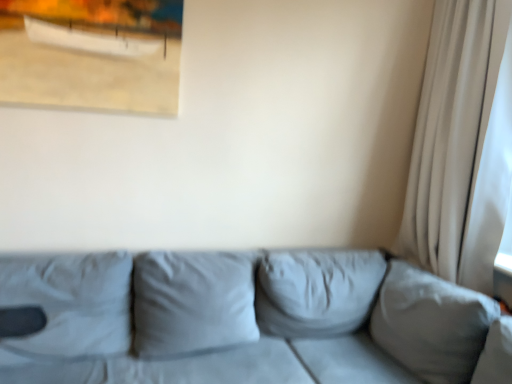
Measure the distance between suede gray couch at center and camera.

The distance of suede gray couch at center from camera is 5.02 feet.

What do you see at coordinates (244, 320) in the screenshot? I see `suede gray couch at center` at bounding box center [244, 320].

At what (x,y) coordinates should I click in order to perform the action: click on matte wooden picture frame at upper left. Please return your answer as a coordinate pair (x, y). The image size is (512, 384). Looking at the image, I should click on (91, 54).

The height and width of the screenshot is (384, 512). What do you see at coordinates (91, 54) in the screenshot?
I see `matte wooden picture frame at upper left` at bounding box center [91, 54].

What is the approximate width of white sheer curtain at right?

white sheer curtain at right is 38.11 centimeters wide.

The image size is (512, 384). Identify the location of suede gray couch at center. (244, 320).

From the image's perspective, does white sheer curtain at right appear lower than suede gray couch at center?

No, from the image's perspective, white sheer curtain at right is not below suede gray couch at center.

Can you confirm if white sheer curtain at right is shorter than suede gray couch at center?

No.

Based on the photo, how many degrees apart are the facing directions of white sheer curtain at right and suede gray couch at center?

93.3 degrees separate the facing orientations of white sheer curtain at right and suede gray couch at center.

Considering the positions of points (475, 183) and (173, 306), is point (475, 183) farther from camera compared to point (173, 306)?

That is True.

Is suede gray couch at center at the left side of white sheer curtain at right?

Yes.

Who is taller, suede gray couch at center or white sheer curtain at right?

With more height is white sheer curtain at right.

Considering the points (417, 308) and (452, 236), which point is in front, point (417, 308) or point (452, 236)?

The point (417, 308) is more forward.

Is matte wooden picture frame at upper left further to camera compared to white sheer curtain at right?

Yes, the depth of matte wooden picture frame at upper left is greater than that of white sheer curtain at right.

Between matte wooden picture frame at upper left and white sheer curtain at right, which one has less height?

matte wooden picture frame at upper left.

Looking at the image, does matte wooden picture frame at upper left seem bigger or smaller compared to white sheer curtain at right?

In the image, matte wooden picture frame at upper left appears to be smaller than white sheer curtain at right.

At what (x,y) coordinates should I click in order to perform the action: click on studio couch on the right of matte wooden picture frame at upper left. Please return your answer as a coordinate pair (x, y). Looking at the image, I should click on pos(244,320).

Are matte wooden picture frame at upper left and suede gray couch at center making contact?

There is a gap between matte wooden picture frame at upper left and suede gray couch at center.

How distant is matte wooden picture frame at upper left from suede gray couch at center?

matte wooden picture frame at upper left is 1.01 meters away from suede gray couch at center.

Is matte wooden picture frame at upper left positioned with its back to suede gray couch at center?

No, matte wooden picture frame at upper left is not facing away from suede gray couch at center.

From the picture: Is matte wooden picture frame at upper left at the back of white sheer curtain at right?

No, white sheer curtain at right is not facing the opposite direction of matte wooden picture frame at upper left.

Considering the sizes of objects white sheer curtain at right and matte wooden picture frame at upper left in the image provided, who is taller, white sheer curtain at right or matte wooden picture frame at upper left?

white sheer curtain at right is taller.

Between point (445, 188) and point (157, 24), which one is positioned in front?

Positioned in front is point (157, 24).

Is white sheer curtain at right positioned far away from matte wooden picture frame at upper left?

Indeed, white sheer curtain at right is not near matte wooden picture frame at upper left.

Looking at this image, does suede gray couch at center have a greater height compared to matte wooden picture frame at upper left?

Yes, suede gray couch at center is taller than matte wooden picture frame at upper left.

In order to click on picture frame located above the suede gray couch at center (from the image's perspective) in this screenshot , I will do `click(91, 54)`.

Is point (330, 268) closer or farther from the camera than point (12, 78)?

Point (330, 268) is positioned farther from the camera compared to point (12, 78).

Where is `studio couch in front of the white sheer curtain at right`? The image size is (512, 384). studio couch in front of the white sheer curtain at right is located at coordinates (244, 320).

Identify the location of curtain that is above the suede gray couch at center (from the image's perspective). This screenshot has width=512, height=384. (462, 145).

Based on their spatial positions, is suede gray couch at center or matte wooden picture frame at upper left further from white sheer curtain at right?

matte wooden picture frame at upper left is positioned further to the anchor white sheer curtain at right.

When comparing their distances from matte wooden picture frame at upper left, does white sheer curtain at right or suede gray couch at center seem closer?

The object closer to matte wooden picture frame at upper left is suede gray couch at center.

Looking at this image, from the image, which object appears to be farther from matte wooden picture frame at upper left, suede gray couch at center or white sheer curtain at right?

white sheer curtain at right.

Based on their spatial positions, is white sheer curtain at right or matte wooden picture frame at upper left closer to suede gray couch at center?

Among the two, white sheer curtain at right is located nearer to suede gray couch at center.

In the scene shown: Looking at the image, which one is located further to white sheer curtain at right, matte wooden picture frame at upper left or suede gray couch at center?

matte wooden picture frame at upper left is further to white sheer curtain at right.

Which object lies further to the anchor point suede gray couch at center, matte wooden picture frame at upper left or white sheer curtain at right?

matte wooden picture frame at upper left is positioned further to the anchor suede gray couch at center.

Where is `studio couch between matte wooden picture frame at upper left and white sheer curtain at right`? This screenshot has width=512, height=384. studio couch between matte wooden picture frame at upper left and white sheer curtain at right is located at coordinates (244, 320).